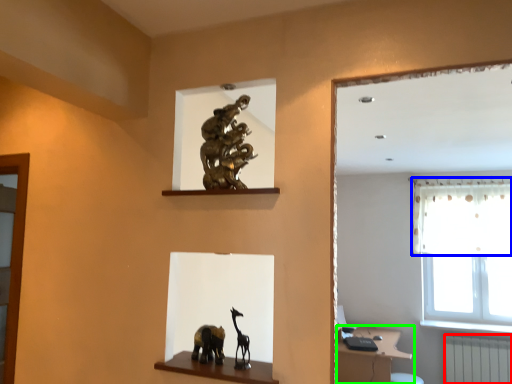
Question: Considering the real-world distances, which object is closest to radiator (highlighted by a red box)? curtain (highlighted by a blue box) or vanity (highlighted by a green box).

Choices:
 (A) curtain
 (B) vanity

Answer: (B)